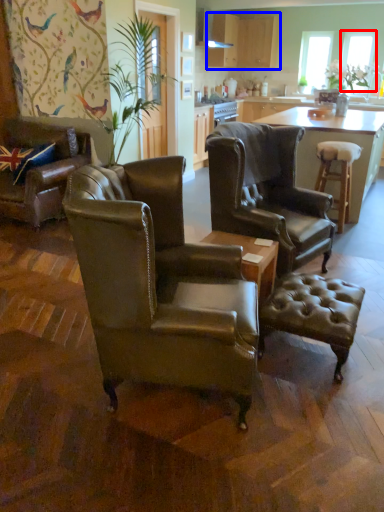
Question: Which of the following is the farthest to the observer, window screen (highlighted by a red box) or cabinetry (highlighted by a blue box)?

Choices:
 (A) window screen
 (B) cabinetry

Answer: (A)